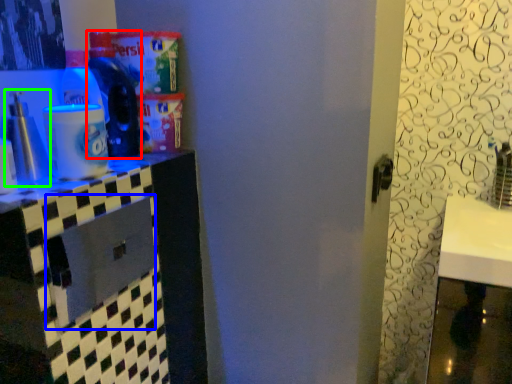
Question: Which object is positioned farthest from bottle (highlighted by a red box)? Select from drawer (highlighted by a blue box) and bottle (highlighted by a green box).

Choices:
 (A) drawer
 (B) bottle

Answer: (A)